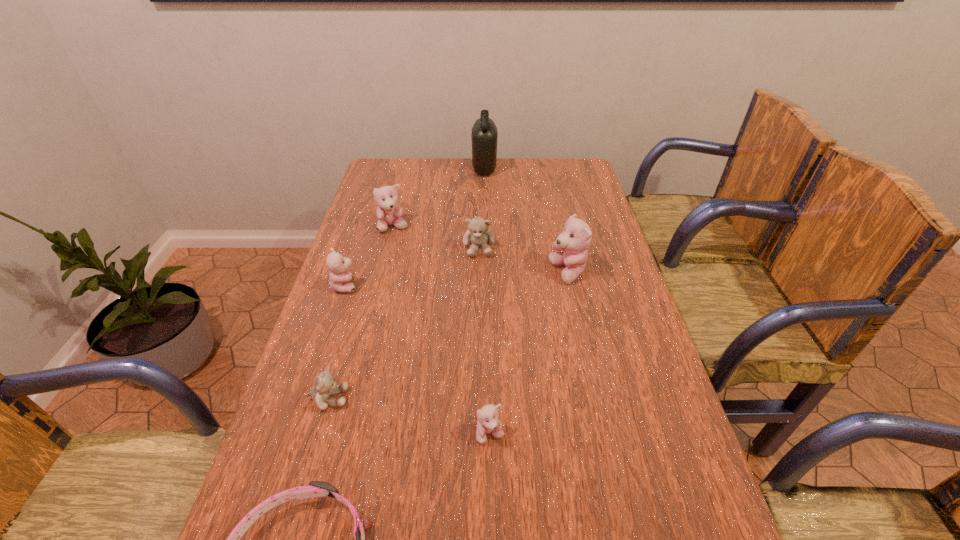
Where is `free space located 0.080m at the face of the nearest teddy bear`? free space located 0.080m at the face of the nearest teddy bear is located at coordinates (492, 487).

Find the location of a particular element. free location located 0.150m on the face of the smaller gray teddy bear is located at coordinates (417, 399).

Where is `object located in the far edge section of the desktop`? The width and height of the screenshot is (960, 540). object located in the far edge section of the desktop is located at coordinates (484, 134).

This screenshot has width=960, height=540. I want to click on object at the right edge, so click(x=575, y=239).

In the image, there is a desktop. Where is `free space at the far edge`? Image resolution: width=960 pixels, height=540 pixels. free space at the far edge is located at coordinates (457, 157).

This screenshot has width=960, height=540. I want to click on vacant space at the left edge of the desktop, so [329, 353].

Locate an element on the screen. free space at the right edge is located at coordinates (613, 315).

The image size is (960, 540). I want to click on free space at the far left corner of the desktop, so click(x=406, y=176).

Find the location of a particular element. The height and width of the screenshot is (540, 960). vacant space that is in between the third biggest pink teddy bear and the smallest pink teddy bear is located at coordinates (418, 360).

This screenshot has width=960, height=540. I want to click on vacant region between the tallest object and the right gray teddy bear, so click(482, 208).